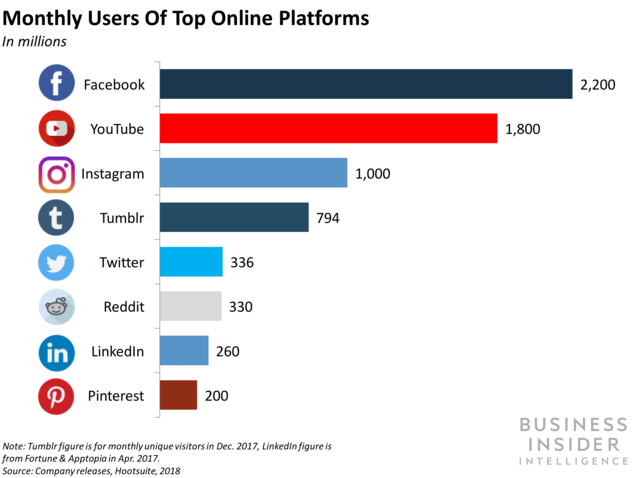
The image size is (640, 478). What are the coordinates of `navy blue bar` in the screenshot? It's located at (294, 90).